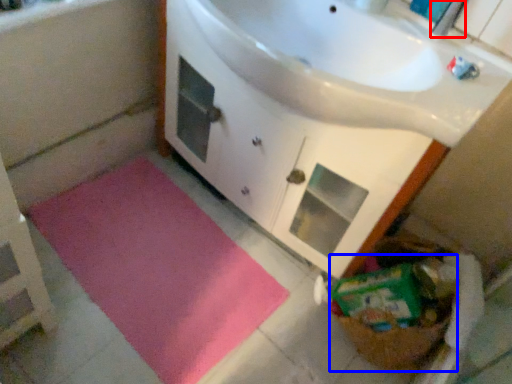
Question: Among these objects, which one is farthest to the camera, faucet (highlighted by a red box) or basket (highlighted by a blue box)?

Choices:
 (A) faucet
 (B) basket

Answer: (B)